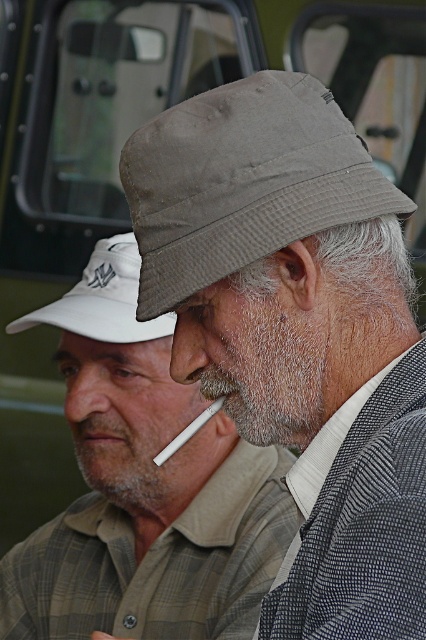
You are a photographer trying to capture a closeup of both the gray fabric hat at upper center and the white fabric cap at upper left in the scene. Given that your camera can only focus on one object at a time, which object should you adjust the focus to first if you want to ensure the wider object is in sharp detail?

The gray fabric hat at upper center is wider than the white fabric cap at upper left. Therefore, you should first adjust the focus to the gray fabric hat at upper center to ensure its wider surface is captured sharply.

You are a photographer trying to capture a photo of the gray fabric hat at upper center and the white fabric cap at upper left. If you want to frame both objects in the same shot, which direction should you move your camera to include both?

You should move your camera to the left to include both the gray fabric hat at upper center and the white fabric cap at upper left since the gray fabric hat at upper center is to the right of the white fabric cap at upper left.